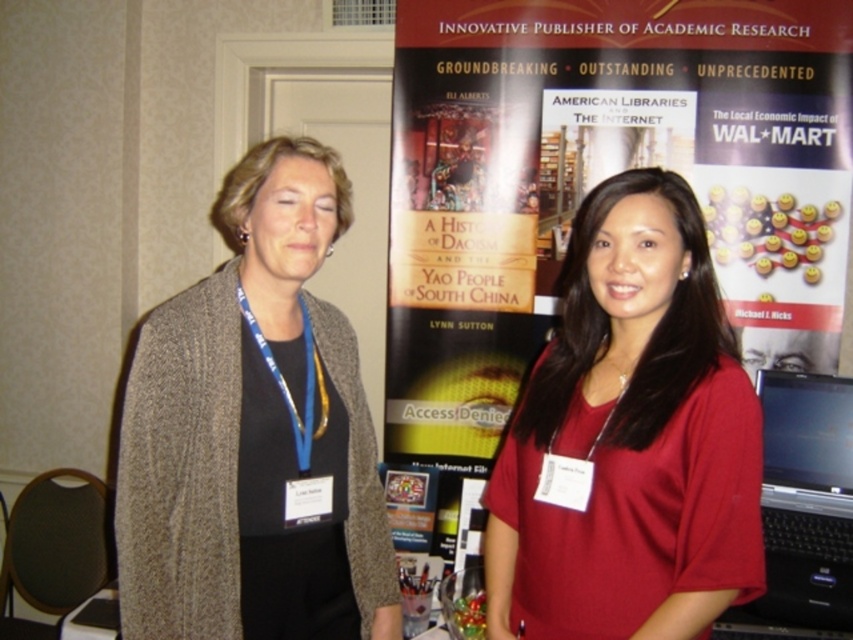
Question: Can you confirm if knit cardigan at left is bigger than matte red shirt at center?

Choices:
 (A) yes
 (B) no

Answer: (A)

Question: Estimate the real-world distances between objects in this image. Which object is farther from the matte black banner at center?

Choices:
 (A) matte red shirt at center
 (B) knit cardigan at left

Answer: (B)

Question: Can you confirm if matte black banner at center is positioned below matte red shirt at center?

Choices:
 (A) yes
 (B) no

Answer: (B)

Question: Estimate the real-world distances between objects in this image. Which object is farther from the knit cardigan at left?

Choices:
 (A) matte red shirt at center
 (B) matte black banner at center

Answer: (B)

Question: Is matte black banner at center below knit cardigan at left?

Choices:
 (A) yes
 (B) no

Answer: (B)

Question: Based on their relative distances, which object is farther from the knit cardigan at left?

Choices:
 (A) matte red shirt at center
 (B) matte black banner at center

Answer: (B)